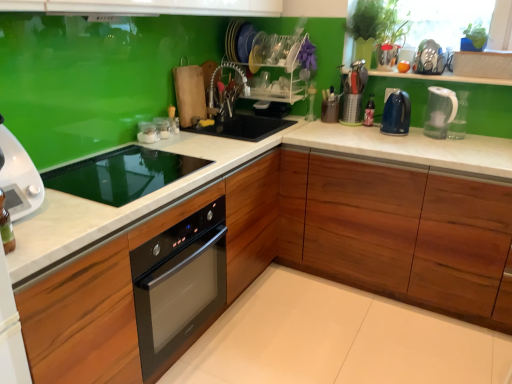
Find the location of a particular element. empty space that is to the right of clear glass jar at upper center, the 1th appliance from the left is located at coordinates (188, 143).